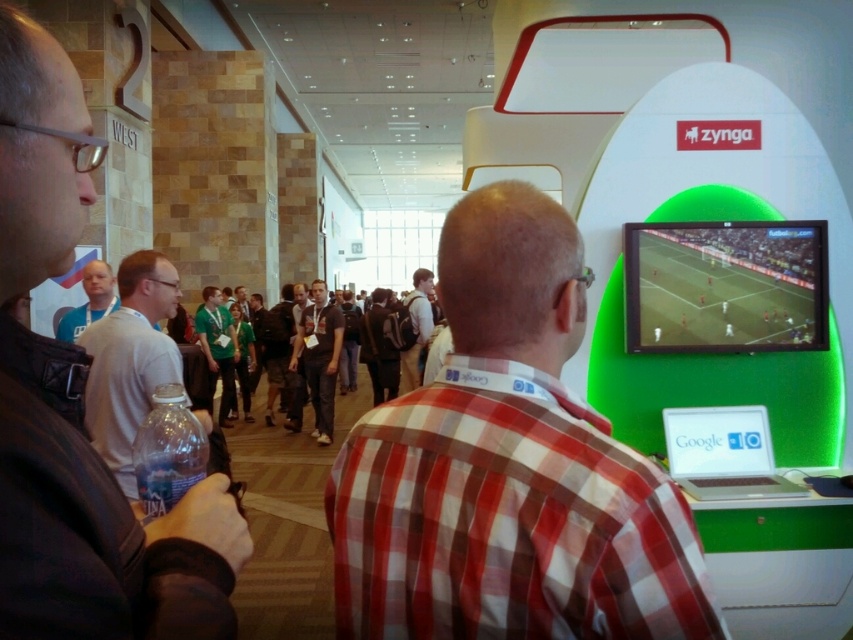
Question: Is dark gray shirt at center closer to the viewer compared to brown leather backpack at center?

Choices:
 (A) no
 (B) yes

Answer: (A)

Question: Can you confirm if dark brown leather jacket at left is thinner than brown leather backpack at center?

Choices:
 (A) yes
 (B) no

Answer: (A)

Question: Which point is closer to the camera?

Choices:
 (A) brown leather backpack at center
 (B) matte blue shirt at center

Answer: (B)

Question: Can you confirm if brown leather backpack at center is wider than matte blue shirt at center?

Choices:
 (A) no
 (B) yes

Answer: (A)

Question: Which of the following is the farthest from the observer?

Choices:
 (A) green fabric shirt at center
 (B) brown leather backpack at center
 (C) dark gray shirt at center
 (D) dark brown leather jacket at left

Answer: (C)

Question: Which of the following is the closest to the observer?

Choices:
 (A) green fabric shirt at center
 (B) brown leather backpack at center
 (C) matte blue shirt at center
 (D) dark gray shirt at center

Answer: (C)